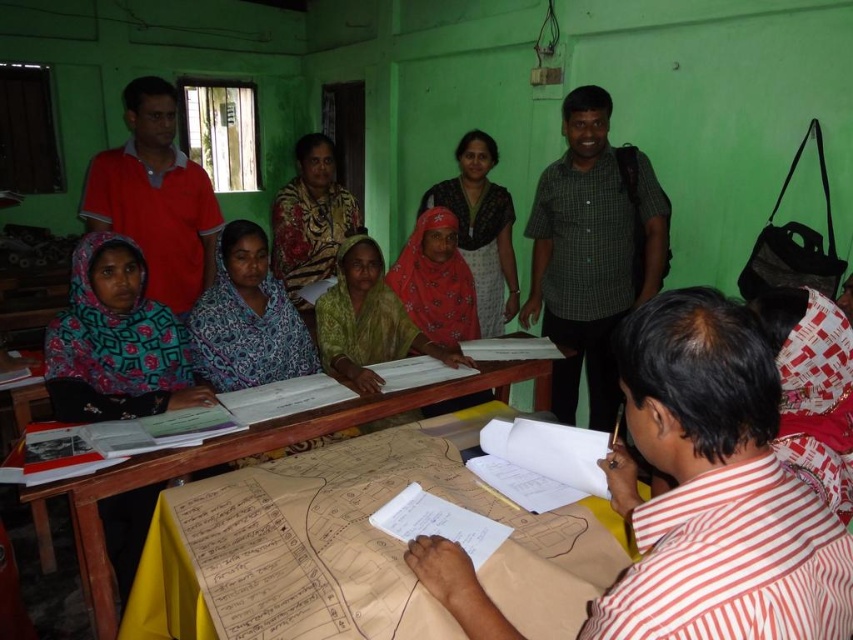
Question: Which of the following is the closest to the observer?

Choices:
 (A) [x=605, y=122]
 (B) [x=93, y=486]
 (C) [x=817, y=525]
 (D) [x=125, y=202]

Answer: (C)

Question: Which object is the farthest from the yellow fabric-covered table at center?

Choices:
 (A) green checkered shirt at upper right
 (B) striped cotton shirt at center
 (C) red cotton shirt at upper left

Answer: (C)

Question: Estimate the real-world distances between objects in this image. Which object is closer to the red cotton shirt at upper left?

Choices:
 (A) green checkered shirt at upper right
 (B) striped cotton shirt at center

Answer: (A)

Question: Where is striped cotton shirt at center located in relation to yellow fabric-covered table at center in the image?

Choices:
 (A) left
 (B) right

Answer: (B)

Question: Is green checkered shirt at upper right to the right of yellow fabric-covered table at center from the viewer's perspective?

Choices:
 (A) yes
 (B) no

Answer: (A)

Question: Is striped cotton shirt at center below yellow fabric-covered table at center?

Choices:
 (A) yes
 (B) no

Answer: (B)